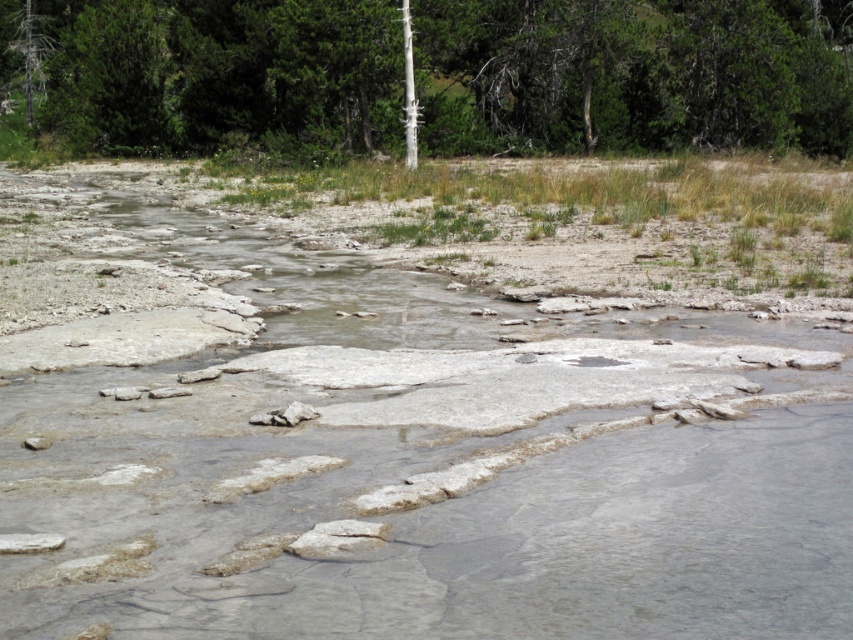
You are standing at the edge of the gray stone river at center and want to look up at the green textured tree at upper center. Which direction should you face to see the tree directly above the river?

You should face upward because the green textured tree at upper center is positioned above the gray stone river at center.

You are planning to cross the gray stone river at center while avoiding the green textured tree at upper center. Which object takes up more space in the image?

The green textured tree at upper center occupies more space than the gray stone river at center.